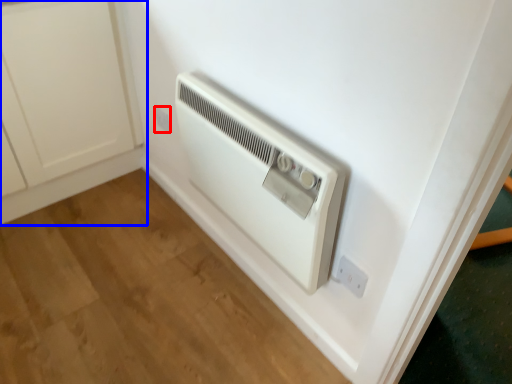
Question: Which object appears closest to the camera in this image, electric outlet (highlighted by a red box) or cabinetry (highlighted by a blue box)?

Choices:
 (A) electric outlet
 (B) cabinetry

Answer: (B)